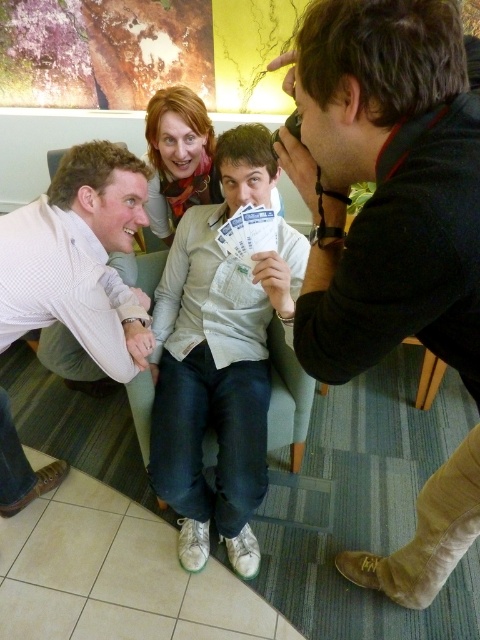
Question: Which of the following is the farthest from the observer?

Choices:
 (A) coord(168,138)
 (B) coord(307,29)

Answer: (A)

Question: Which point is farther from the camera taking this photo?

Choices:
 (A) (86, 360)
 (B) (406, 72)
 (C) (228, 250)

Answer: (A)

Question: Where is white dotted shirt at lower left located in relation to white paper cards at center in the image?

Choices:
 (A) left
 (B) right

Answer: (A)

Question: Which of the following is the closest to the observer?

Choices:
 (A) (175, 160)
 (B) (328, 257)

Answer: (B)

Question: Is white dotted shirt at lower left below light beige sweater at center?

Choices:
 (A) no
 (B) yes

Answer: (B)

Question: Is black leather camera at upper right wider than orange scarf at center?

Choices:
 (A) yes
 (B) no

Answer: (A)